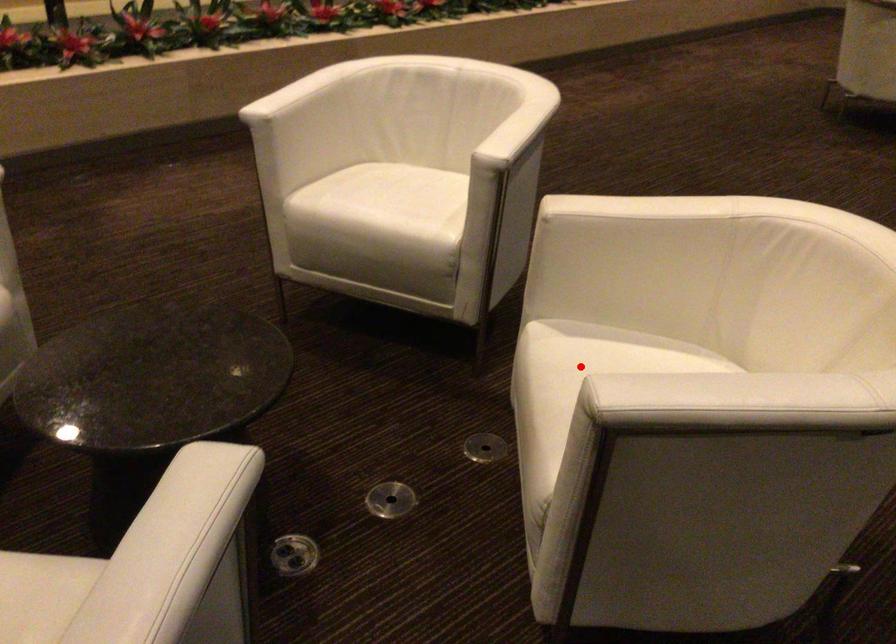
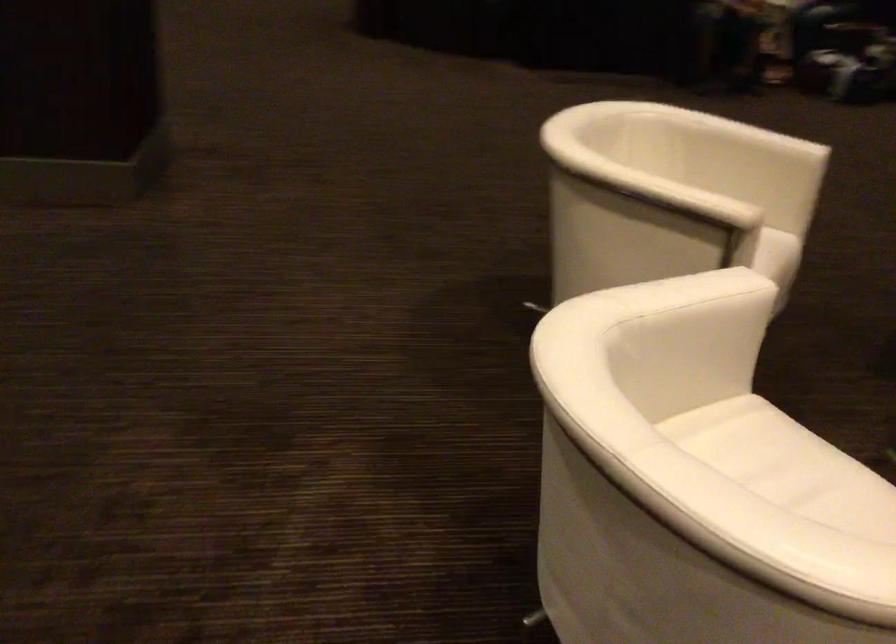
Question: I am providing you with two images of the same scene from different viewpoints. A red point is marked on the first image. At the location where the point appears in image 1, is it still visible in image 2?

Choices:
 (A) Yes
 (B) No

Answer: (B)